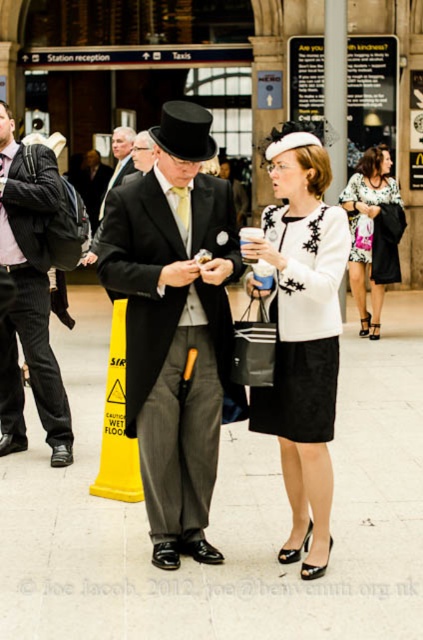
Question: Does black textured dress at center appear under floral dress at center?

Choices:
 (A) yes
 (B) no

Answer: (A)

Question: Is pinstriped fabric suit at left behind floral dress at center?

Choices:
 (A) yes
 (B) no

Answer: (B)

Question: Which point is farther to the camera?

Choices:
 (A) black textured dress at center
 (B) matte black coat at center

Answer: (B)

Question: Observing the image, what is the correct spatial positioning of black textured dress at center in reference to floral dress at center?

Choices:
 (A) left
 (B) right

Answer: (A)

Question: Among these points, which one is farthest from the camera?

Choices:
 (A) (279, 429)
 (B) (134, 168)

Answer: (B)

Question: Among these objects, which one is nearest to the camera?

Choices:
 (A) pinstriped fabric suit at left
 (B) white matte dress at center

Answer: (B)